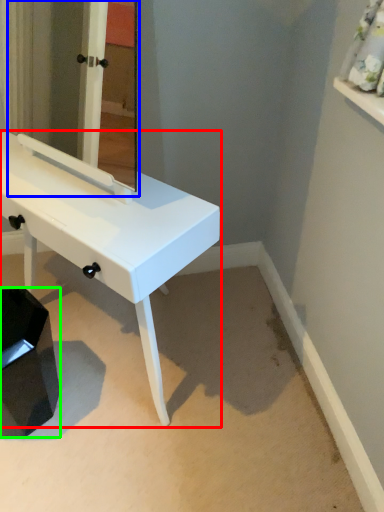
Question: Which is nearer to the table (highlighted by a red box)? mirror (highlighted by a blue box) or step stool (highlighted by a green box).

Choices:
 (A) mirror
 (B) step stool

Answer: (B)